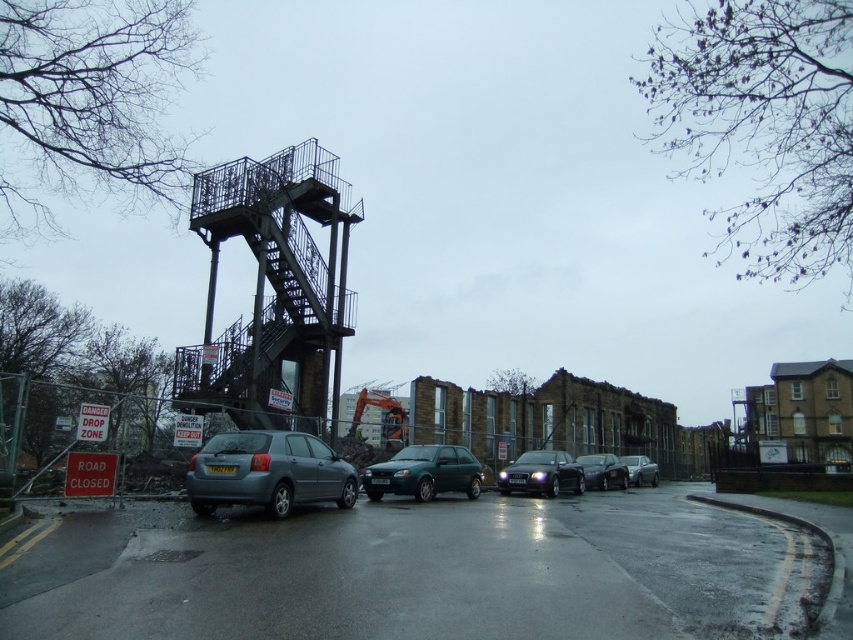
You are standing at the camera position in the urban scene. There are two points marked in the image. The first point is at coordinates point (x=233, y=451) and the second point is at point (x=552, y=454). Which of these two points is nearer to you?

Point (x=233, y=451) is closer to the camera than point (x=552, y=454), so the first point is nearer to you.

You are driving a matte gray hatchback at center and want to exit the parking area. There is a green matte hatchback at center blocking your path. Can you move forward to get past it?

The matte gray hatchback at center is in front of the green matte hatchback at center, so it is already ahead of it. Therefore, you can move forward to get past the green matte hatchback at center.